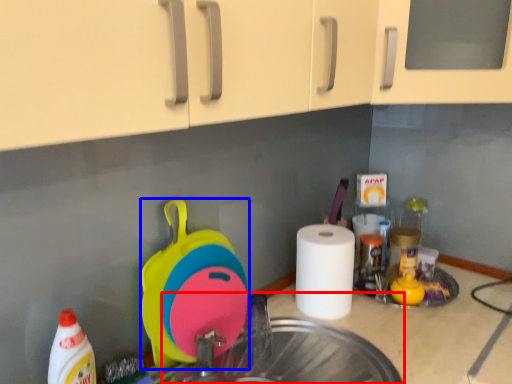
Question: Which of the following is the farthest to the observer, sink (highlighted by a red box) or appliance (highlighted by a blue box)?

Choices:
 (A) sink
 (B) appliance

Answer: (B)